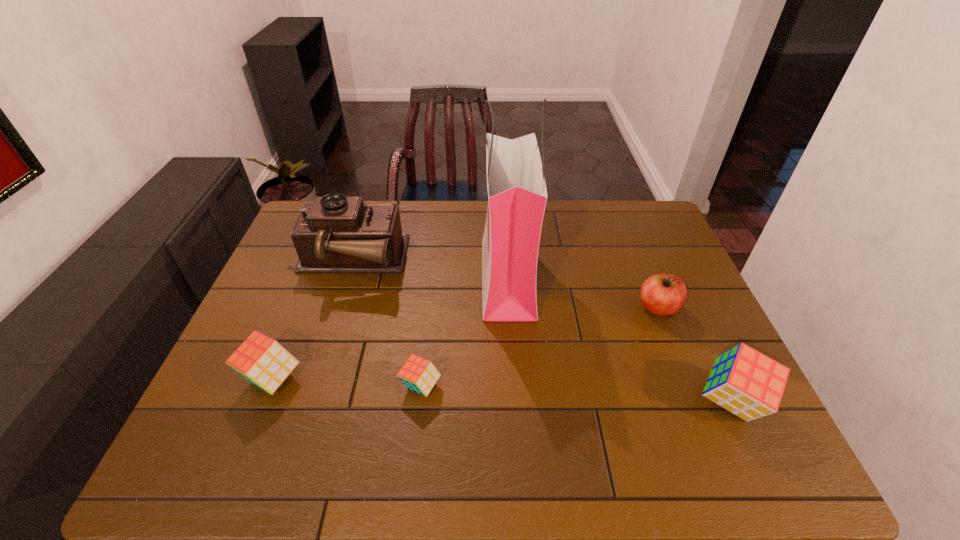
This screenshot has width=960, height=540. Identify the location of empty space between the rightmost cube and the second cube from right to left. (576, 394).

I want to click on free space between the shopping bag and the second shortest cube, so click(x=390, y=328).

Locate an element on the screen. The image size is (960, 540). vacant area that lies between the apple and the shortest object is located at coordinates (540, 347).

Where is `blank region between the rightmost cube and the apple`? This screenshot has height=540, width=960. blank region between the rightmost cube and the apple is located at coordinates (695, 354).

This screenshot has width=960, height=540. In order to click on free space between the phonograph_record and the leftmost cube in this screenshot , I will do `click(310, 320)`.

You are a GUI agent. You are given a task and a screenshot of the screen. Output one action in this format:
    pyautogui.click(x=<x>, y=<y>)
    Task: Click on the free space between the apple and the shortest object
    The width and height of the screenshot is (960, 540).
    Given the screenshot: What is the action you would take?
    pyautogui.click(x=540, y=347)

The width and height of the screenshot is (960, 540). What are the coordinates of `free space between the second cube from left to right and the second tallest cube` in the screenshot? It's located at (347, 382).

At what (x,y) coordinates should I click in order to perform the action: click on free space between the second tallest cube and the shopping bag. Please return your answer as a coordinate pair (x, y). Looking at the image, I should click on (390, 328).

The width and height of the screenshot is (960, 540). In order to click on empty location between the rightmost cube and the shopping bag in this screenshot , I will do `click(619, 340)`.

Locate an element on the screen. The width and height of the screenshot is (960, 540). vacant space in between the rightmost cube and the leftmost cube is located at coordinates (502, 390).